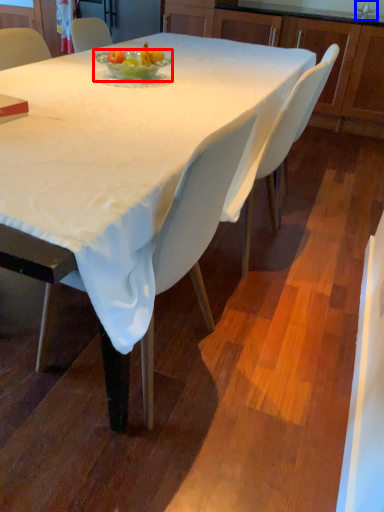
Question: Which point is further to the camera, bowl (highlighted by a red box) or faucet (highlighted by a blue box)?

Choices:
 (A) bowl
 (B) faucet

Answer: (B)